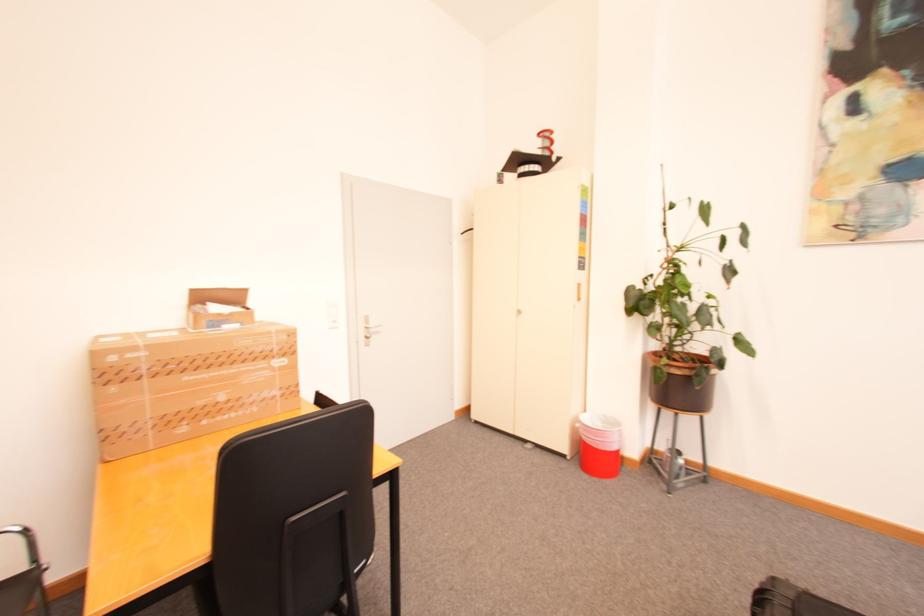
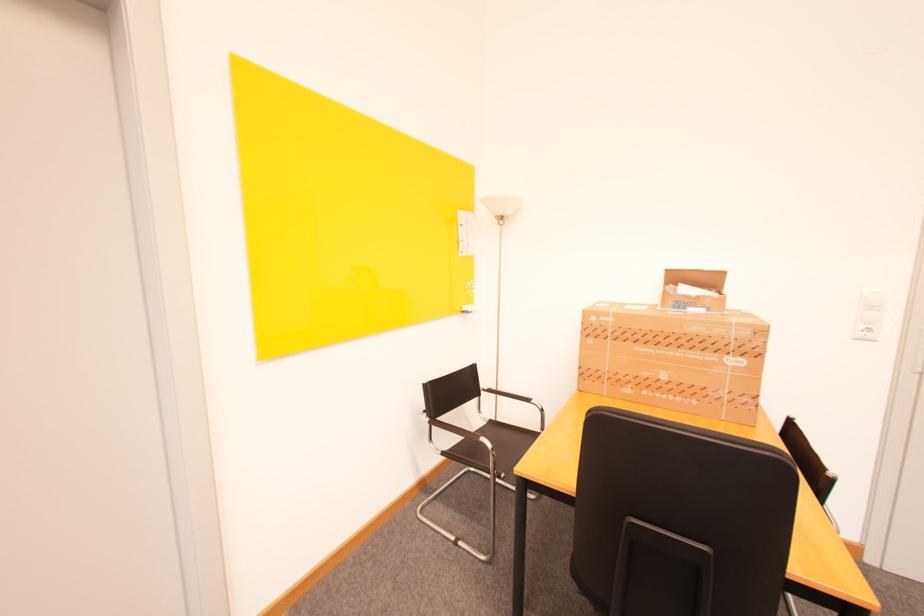
In the second image, find the point that corresponds to (248,326) in the first image.

(714, 310)